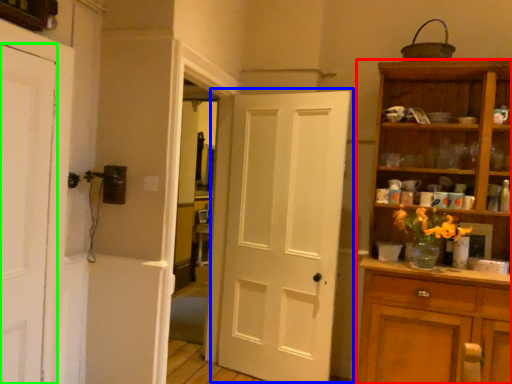
Question: Based on their relative distances, which object is farther from cupboard (highlighted by a red box)? Choose from door (highlighted by a blue box) and door (highlighted by a green box).

Choices:
 (A) door
 (B) door

Answer: (B)